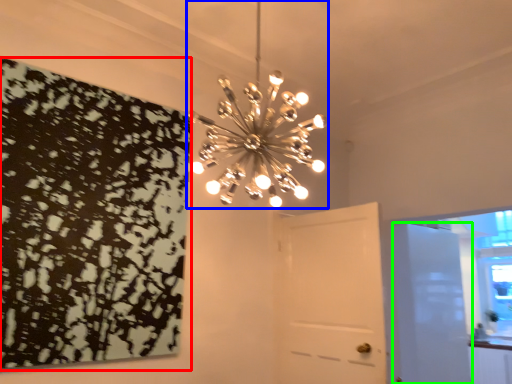
Question: Which is nearer to the print (highlighted by a red box)? lamp (highlighted by a blue box) or door (highlighted by a green box).

Choices:
 (A) lamp
 (B) door

Answer: (A)